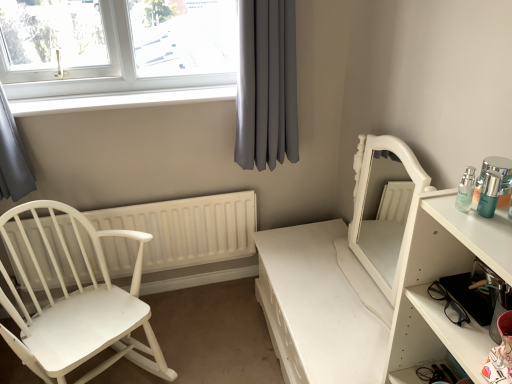
Where is `free space in front of white glossy mirror at right`? free space in front of white glossy mirror at right is located at coordinates (349, 330).